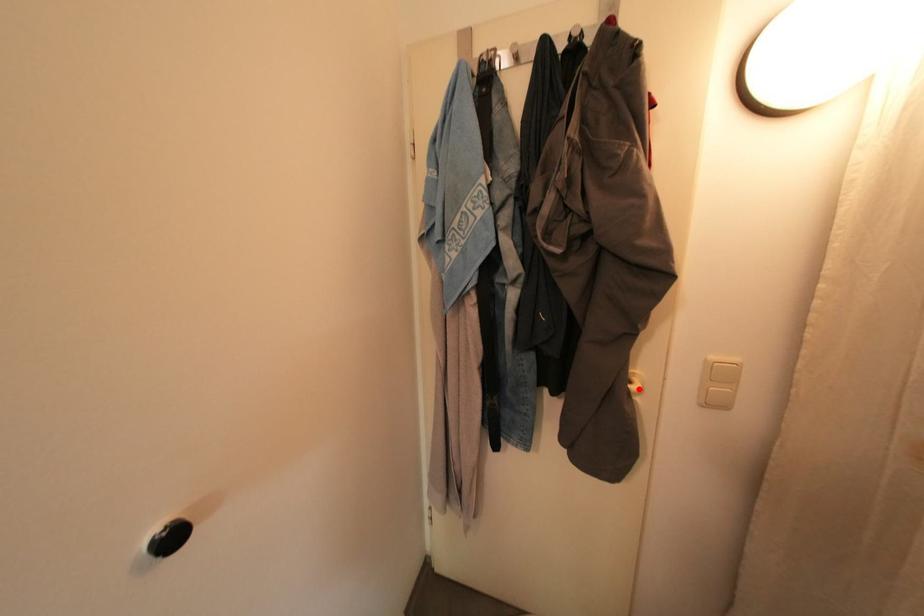
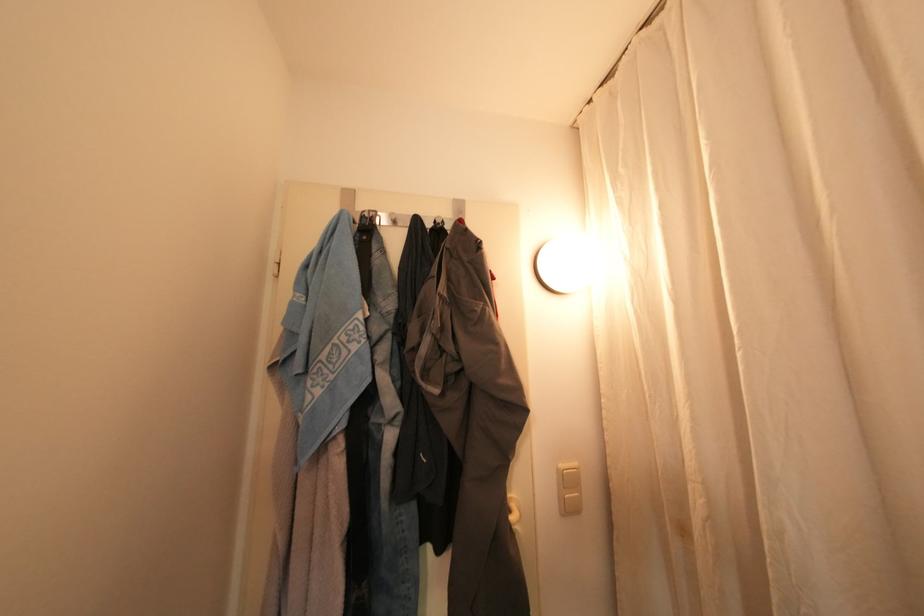
Where in the second image is the point corresponding to the highlighted location from the first image?

(517, 519)